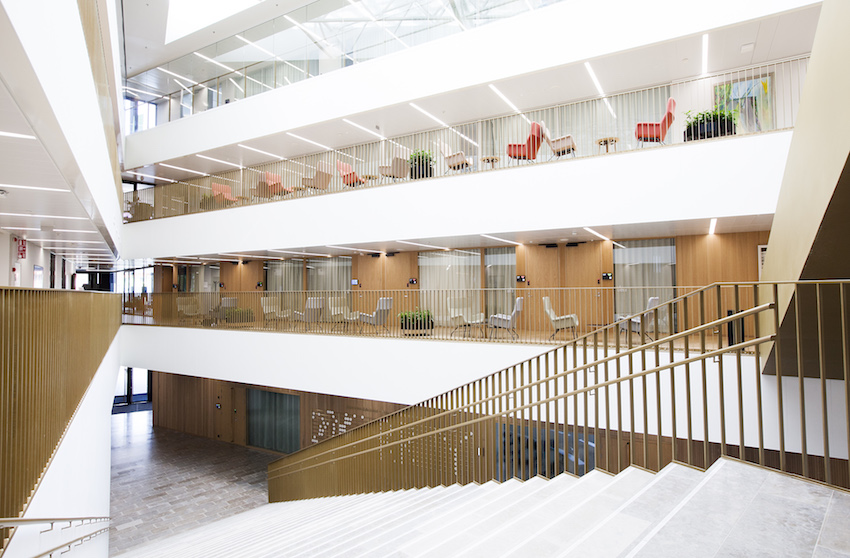
Find the location of a particular element. Image resolution: width=850 pixels, height=558 pixels. colorful chairs is located at coordinates (217, 194), (270, 186), (347, 170), (314, 180), (524, 145), (649, 129).